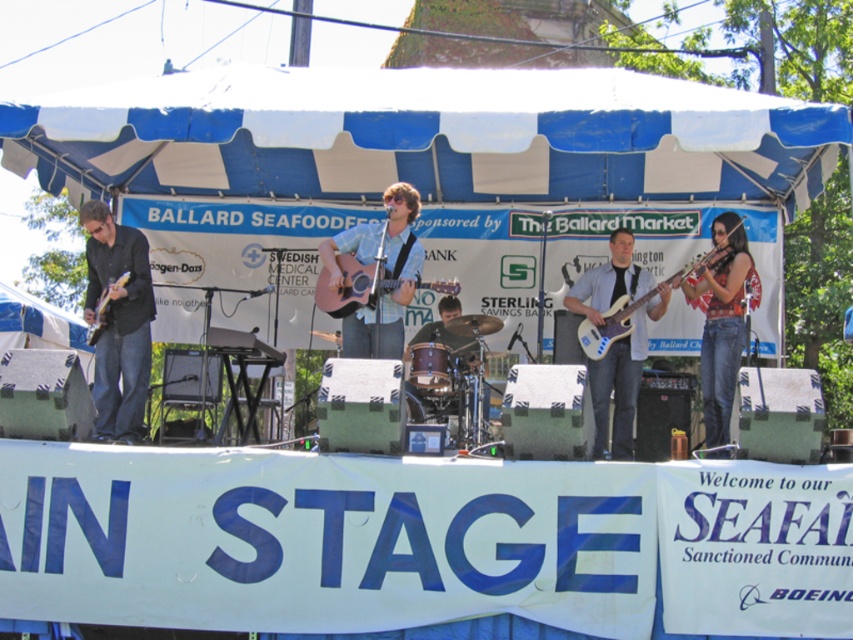
You are a stagehand who needs to move a 3.5 feet wide equipment cart from the denim jeans at right to the matte wood guitar at center. Can the cart fit through the space between them?

The distance between denim jeans at right and matte wood guitar at center is 9.34 feet. Since the equipment cart is 3.5 feet wide, it can easily fit through the space as 9.34 feet is greater than 3.5 feet.

You are setting up a music stand between the matte wood guitar at center and the matte brown acoustic guitar at left. Which guitar should you place the stand closer to to ensure it doesn stand in the way of the wider instrument?

The matte wood guitar at center might be wider than the matte brown acoustic guitar at left, so you should place the stand closer to the matte wood guitar at center to avoid blocking its space.

You are a photographer at the Ballard Seafood Festival. You need to capture a closeup shot of the matte wood guitar at center. According to the scene coordinates, where exactly is the matte wood guitar located?

The matte wood guitar at center is located at coordinates point (352, 285).